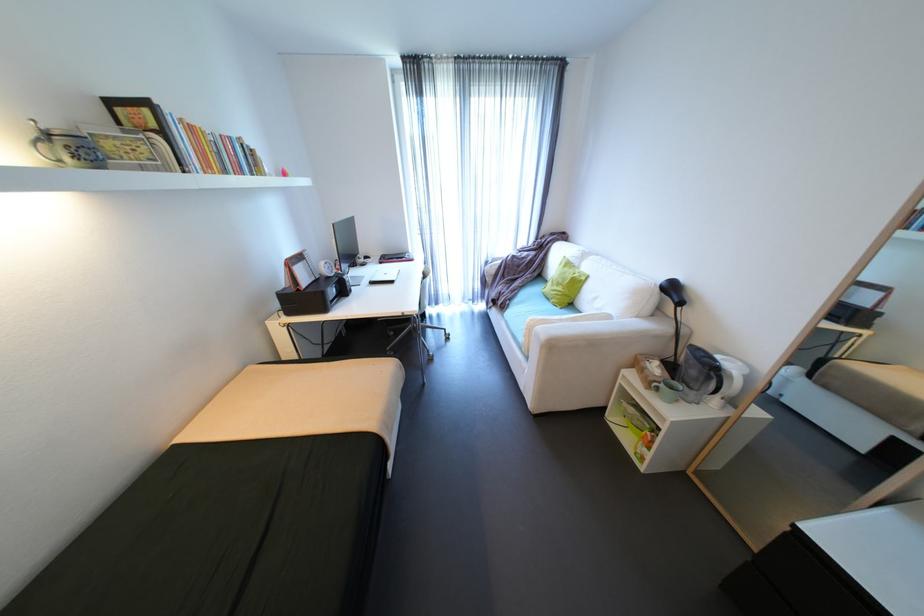
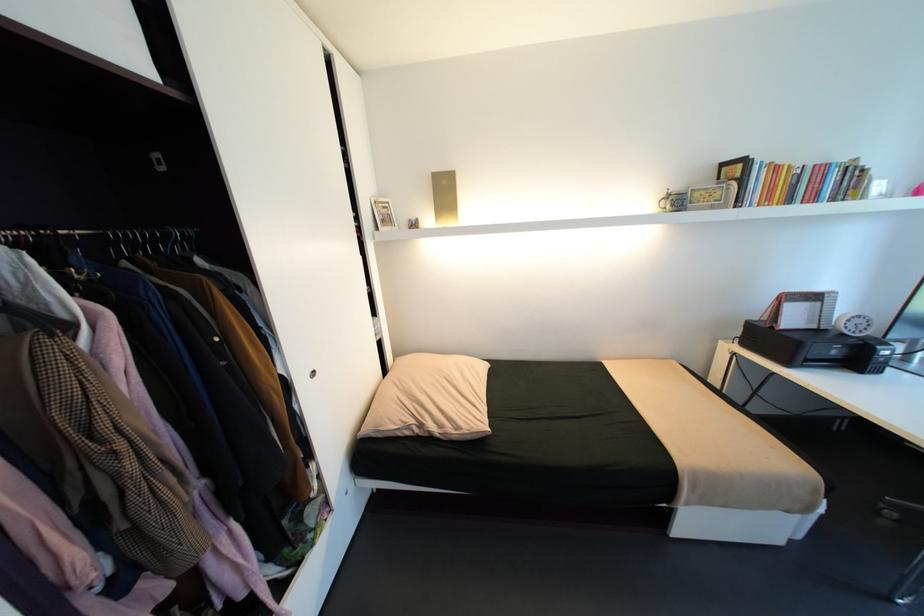
Find the pixel in the second image that matches (x=110, y=146) in the first image.

(700, 196)